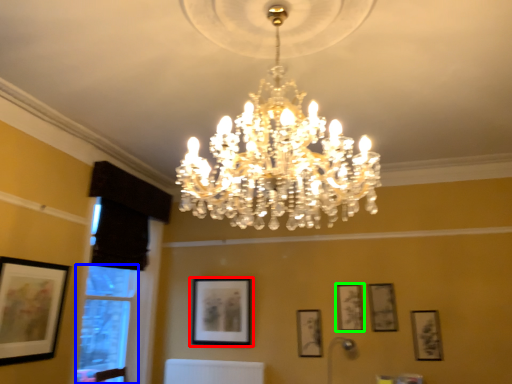
Question: Considering the real-world distances, which object is closest to picture frame (highlighted by a red box)? window (highlighted by a blue box) or picture frame (highlighted by a green box).

Choices:
 (A) window
 (B) picture frame

Answer: (A)